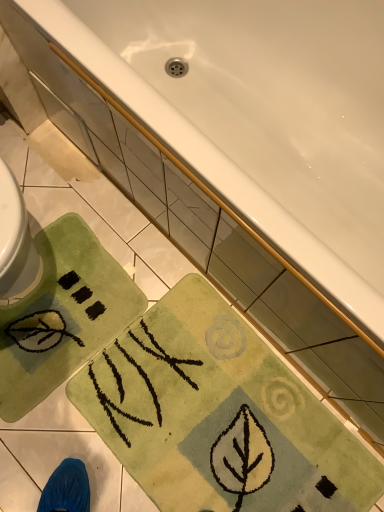
The image size is (384, 512). Describe the element at coordinates (62, 315) in the screenshot. I see `green soft rug at lower left, positioned as the 1th beach towel in left-to-right order` at that location.

You are a GUI agent. You are given a task and a screenshot of the screen. Output one action in this format:
    pyautogui.click(x=<x>, y=<y>)
    Task: Click on the green soft rug at lower left, the 2th beach towel from the right
    This screenshot has width=384, height=512.
    Given the screenshot: What is the action you would take?
    pyautogui.click(x=62, y=315)

Does green soft rug at lower center, the 1th beach towel viewed from the right, contain green soft rug at lower left, the 2th beach towel from the right?

No, green soft rug at lower left, the 2th beach towel from the right, is not inside green soft rug at lower center, the 1th beach towel viewed from the right.

Which object is positioned more to the left, green soft rug at lower center, placed as the 2th beach towel when sorted from left to right, or green soft rug at lower left, positioned as the 1th beach towel in left-to-right order?

green soft rug at lower left, positioned as the 1th beach towel in left-to-right order, is more to the left.

Between green soft rug at lower center, the 1th beach towel viewed from the right, and green soft rug at lower left, the 2th beach towel from the right, which one has less height?

green soft rug at lower center, the 1th beach towel viewed from the right, is shorter.

From the image's perspective, is green soft rug at lower center, the 1th beach towel viewed from the right, on green soft rug at lower left, positioned as the 1th beach towel in left-to-right order?

Incorrect, from the image's perspective, green soft rug at lower center, the 1th beach towel viewed from the right, is lower than green soft rug at lower left, positioned as the 1th beach towel in left-to-right order.

Is green soft rug at lower left, the 2th beach towel from the right, outside of green soft rug at lower center, the 1th beach towel viewed from the right?

That's correct, green soft rug at lower left, the 2th beach towel from the right, is outside of green soft rug at lower center, the 1th beach towel viewed from the right.

From a real-world perspective, who is located lower, green soft rug at lower left, positioned as the 1th beach towel in left-to-right order, or green soft rug at lower center, the 1th beach towel viewed from the right?

green soft rug at lower center, the 1th beach towel viewed from the right, is physically lower.

Which of these two, green soft rug at lower left, positioned as the 1th beach towel in left-to-right order, or green soft rug at lower center, placed as the 2th beach towel when sorted from left to right, is thinner?

With smaller width is green soft rug at lower left, positioned as the 1th beach towel in left-to-right order.

From the image's perspective, relative to green soft rug at lower center, the 1th beach towel viewed from the right, is green soft rug at lower left, the 2th beach towel from the right, above or below?

From the image's perspective, green soft rug at lower left, the 2th beach towel from the right, appears above green soft rug at lower center, the 1th beach towel viewed from the right.

Are green soft rug at lower left, positioned as the 1th beach towel in left-to-right order, and white glossy bathtub at upper center making contact?

green soft rug at lower left, positioned as the 1th beach towel in left-to-right order, is not next to white glossy bathtub at upper center, and they're not touching.

Relative to white glossy bathtub at upper center, is green soft rug at lower left, the 2th beach towel from the right, in front or behind?

Clearly, green soft rug at lower left, the 2th beach towel from the right, is behind white glossy bathtub at upper center.

Does green soft rug at lower left, positioned as the 1th beach towel in left-to-right order, have a lesser width compared to white glossy bathtub at upper center?

Indeed, green soft rug at lower left, positioned as the 1th beach towel in left-to-right order, has a lesser width compared to white glossy bathtub at upper center.

Choose the correct answer: Is green soft rug at lower left, positioned as the 1th beach towel in left-to-right order, inside white glossy bathtub at upper center or outside it?

green soft rug at lower left, positioned as the 1th beach towel in left-to-right order, is not enclosed by white glossy bathtub at upper center.

Between white glossy bathtub at upper center and green soft rug at lower left, the 2th beach towel from the right, which one has less height?

green soft rug at lower left, the 2th beach towel from the right, is shorter.

Image resolution: width=384 pixels, height=512 pixels. Find the location of `bathtub above the green soft rug at lower left, positioned as the 1th beach towel in left-to-right order (from a real-world perspective)`. bathtub above the green soft rug at lower left, positioned as the 1th beach towel in left-to-right order (from a real-world perspective) is located at coordinates (256, 124).

Based on their positions, is white glossy bathtub at upper center located to the left or right of green soft rug at lower left, positioned as the 1th beach towel in left-to-right order?

In the image, white glossy bathtub at upper center appears on the right side of green soft rug at lower left, positioned as the 1th beach towel in left-to-right order.

Which object is more forward, white glossy bathtub at upper center or green soft rug at lower center, the 1th beach towel viewed from the right?

white glossy bathtub at upper center is more forward.

How many degrees apart are the facing directions of white glossy bathtub at upper center and green soft rug at lower center, placed as the 2th beach towel when sorted from left to right?

The angle between the facing direction of white glossy bathtub at upper center and the facing direction of green soft rug at lower center, placed as the 2th beach towel when sorted from left to right, is 0.0929 degrees.

Is white glossy bathtub at upper center oriented towards green soft rug at lower center, the 1th beach towel viewed from the right?

Yes, white glossy bathtub at upper center faces towards green soft rug at lower center, the 1th beach towel viewed from the right.

Which is nearer, (380, 273) or (268, 505)?

Positioned in front is point (268, 505).

Does green soft rug at lower center, placed as the 2th beach towel when sorted from left to right, have a lesser width compared to white glossy bathtub at upper center?

Correct, the width of green soft rug at lower center, placed as the 2th beach towel when sorted from left to right, is less than that of white glossy bathtub at upper center.

Between green soft rug at lower center, the 1th beach towel viewed from the right, and white glossy bathtub at upper center, which one appears on the left side from the viewer's perspective?

From the viewer's perspective, green soft rug at lower center, the 1th beach towel viewed from the right, appears more on the left side.

Can you tell me how much green soft rug at lower center, placed as the 2th beach towel when sorted from left to right, and white glossy bathtub at upper center differ in facing direction?

The angle between the facing direction of green soft rug at lower center, placed as the 2th beach towel when sorted from left to right, and the facing direction of white glossy bathtub at upper center is 0.0929 degrees.

I want to click on beach towel that appears behind the green soft rug at lower center, placed as the 2th beach towel when sorted from left to right, so click(x=62, y=315).

I want to click on beach towel in front of the green soft rug at lower left, the 2th beach towel from the right, so click(219, 416).

Based on their spatial positions, is green soft rug at lower center, placed as the 2th beach towel when sorted from left to right, or green soft rug at lower left, the 2th beach towel from the right, further from white glossy bathtub at upper center?

green soft rug at lower left, the 2th beach towel from the right.

Estimate the real-world distances between objects in this image. Which object is closer to green soft rug at lower left, positioned as the 1th beach towel in left-to-right order, white glossy bathtub at upper center or green soft rug at lower center, the 1th beach towel viewed from the right?

green soft rug at lower center, the 1th beach towel viewed from the right, is positioned closer to the anchor green soft rug at lower left, positioned as the 1th beach towel in left-to-right order.

Estimate the real-world distances between objects in this image. Which object is further from green soft rug at lower center, the 1th beach towel viewed from the right, green soft rug at lower left, positioned as the 1th beach towel in left-to-right order, or white glossy bathtub at upper center?

white glossy bathtub at upper center is positioned further to the anchor green soft rug at lower center, the 1th beach towel viewed from the right.

From the image, which object appears to be nearer to green soft rug at lower center, the 1th beach towel viewed from the right, white glossy bathtub at upper center or green soft rug at lower left, the 2th beach towel from the right?

Among the two, green soft rug at lower left, the 2th beach towel from the right, is located nearer to green soft rug at lower center, the 1th beach towel viewed from the right.

Estimate the real-world distances between objects in this image. Which object is closer to green soft rug at lower left, positioned as the 1th beach towel in left-to-right order, green soft rug at lower center, placed as the 2th beach towel when sorted from left to right, or white glossy bathtub at upper center?

green soft rug at lower center, placed as the 2th beach towel when sorted from left to right, is positioned closer to the anchor green soft rug at lower left, positioned as the 1th beach towel in left-to-right order.

Estimate the real-world distances between objects in this image. Which object is closer to white glossy bathtub at upper center, green soft rug at lower left, positioned as the 1th beach towel in left-to-right order, or green soft rug at lower center, placed as the 2th beach towel when sorted from left to right?

Based on the image, green soft rug at lower center, placed as the 2th beach towel when sorted from left to right, appears to be nearer to white glossy bathtub at upper center.

Locate an element on the screen. The image size is (384, 512). beach towel that lies between white glossy bathtub at upper center and green soft rug at lower center, the 1th beach towel viewed from the right, from top to bottom is located at coordinates (62, 315).